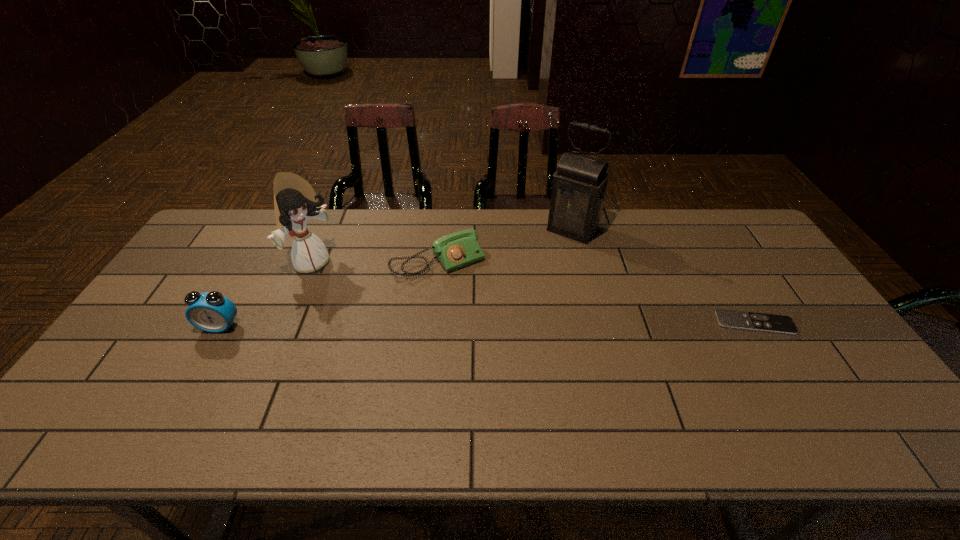
The height and width of the screenshot is (540, 960). What are the coordinates of `free point located 0.360m at the front face of the fourth object from right to left` in the screenshot? It's located at (416, 326).

Find the location of a particular element. Image resolution: width=960 pixels, height=540 pixels. lantern located at the far edge is located at coordinates (578, 194).

You are a GUI agent. You are given a task and a screenshot of the screen. Output one action in this format:
    pyautogui.click(x=<x>, y=<y>)
    Task: Click on the telephone that is at the far edge
    Image resolution: width=960 pixels, height=540 pixels.
    Given the screenshot: What is the action you would take?
    pyautogui.click(x=454, y=251)

In order to click on doll situated at the far edge in this screenshot , I will do `click(295, 201)`.

Locate an element on the screen. object positioned at the right edge is located at coordinates (773, 323).

In the image, there is a desktop. Where is `vacant space at the far edge`? The image size is (960, 540). vacant space at the far edge is located at coordinates (498, 213).

What are the coordinates of `vacant space at the near edge of the desktop` in the screenshot? It's located at (174, 389).

This screenshot has width=960, height=540. In the image, there is a desktop. What are the coordinates of `vacant space at the right edge` in the screenshot? It's located at (746, 260).

Locate an element on the screen. The width and height of the screenshot is (960, 540). free location at the far left corner of the desktop is located at coordinates (210, 249).

Where is `free space at the far right corner`? This screenshot has width=960, height=540. free space at the far right corner is located at coordinates (711, 225).